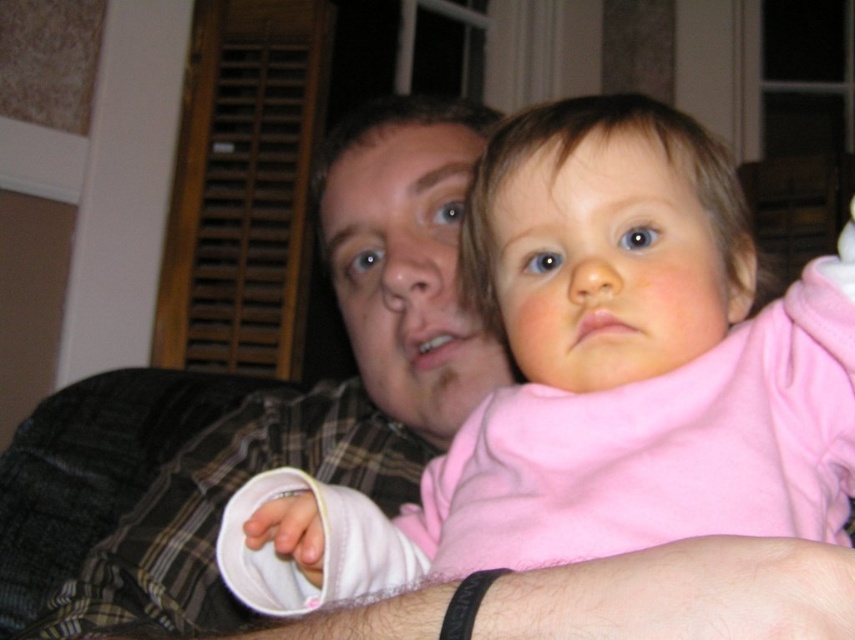
You are a photographer taking a close up of two people, a man and a baby, seated indoors. The man is holding the baby, and you notice a specific point in the image at coordinates point (x=594, y=378). What object is located at that point?

The pink soft fabric baby at center is located at point (x=594, y=378).

You are a photographer trying to capture a close shot of the baby and the man. Since the pink soft fabric baby at center and the plaid shirt at center are both in the frame, which one do you think will appear wider in the photo?

The plaid shirt at center appears wider in the photo because the pink soft fabric baby at center has a lesser width compared to it.

You are a photographer adjusting the lighting in the room. You need to ensure that both the pink soft fabric baby at center and the plaid shirt at center are well lit. Based on their positions, which object should you adjust the light to focus on first to ensure proper illumination?

The pink soft fabric baby at center is positioned under the plaid shirt at center, so you should adjust the light to focus on the pink soft fabric baby at center first to ensure it receives adequate illumination before the plaid shirt at center blocks some of the light.